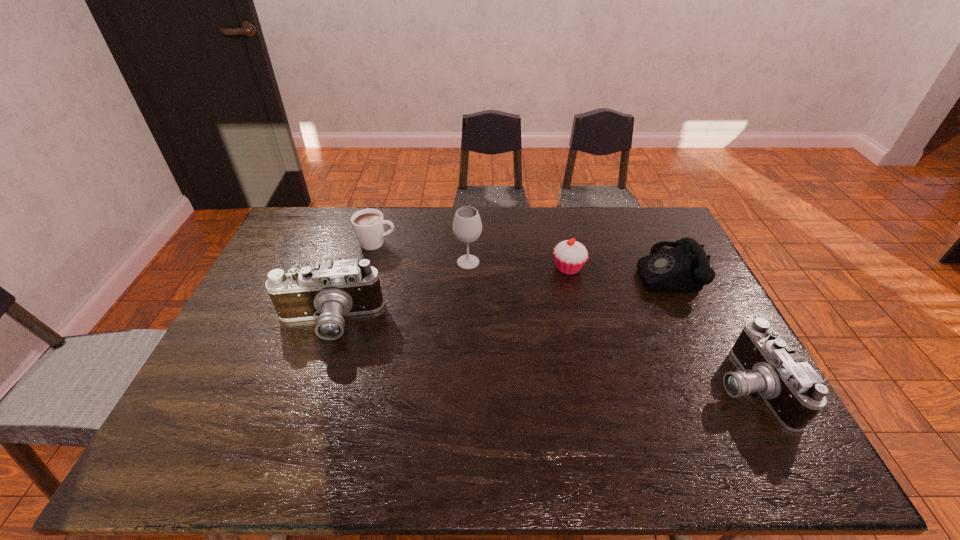
Find the location of a particular element. object positioned at the near edge is located at coordinates (794, 392).

The width and height of the screenshot is (960, 540). Find the location of `object that is at the left edge`. object that is at the left edge is located at coordinates (328, 291).

The width and height of the screenshot is (960, 540). I want to click on camera that is at the right edge, so click(794, 392).

The height and width of the screenshot is (540, 960). Identify the location of telephone located in the right edge section of the desktop. (685, 268).

At what (x,y) coordinates should I click in order to perform the action: click on object that is at the far right corner. Please return your answer as a coordinate pair (x, y). Image resolution: width=960 pixels, height=540 pixels. Looking at the image, I should click on (685, 268).

The image size is (960, 540). In order to click on object present at the near right corner in this screenshot , I will do `click(794, 392)`.

You are a GUI agent. You are given a task and a screenshot of the screen. Output one action in this format:
    pyautogui.click(x=<x>, y=<y>)
    Task: Click on the vacant area at the far edge of the desktop
    This screenshot has height=540, width=960.
    Given the screenshot: What is the action you would take?
    pyautogui.click(x=617, y=232)

Locate an element on the screen. This screenshot has height=540, width=960. vacant region at the near edge of the desktop is located at coordinates (467, 395).

In the image, there is a desktop. At what (x,y) coordinates should I click in order to perform the action: click on vacant space at the left edge. Please return your answer as a coordinate pair (x, y). This screenshot has height=540, width=960. Looking at the image, I should click on (267, 278).

At what (x,y) coordinates should I click in order to perform the action: click on free space at the right edge of the desktop. Please return your answer as a coordinate pair (x, y). This screenshot has width=960, height=540. Looking at the image, I should click on coord(716,343).